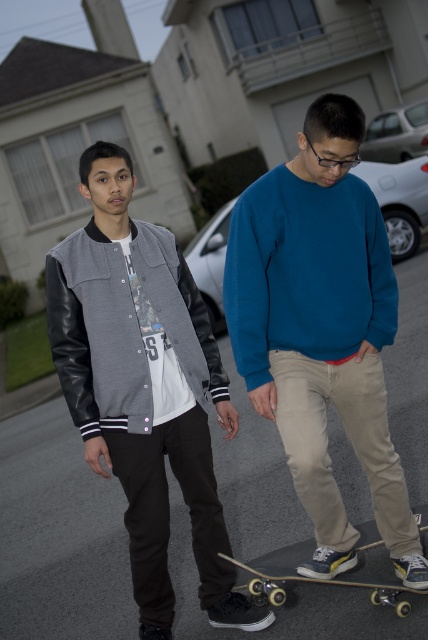
Is gray fabric jacket at center taller than wooden skateboard at lower center?

Yes.

What do you see at coordinates (143, 387) in the screenshot? I see `gray fabric jacket at center` at bounding box center [143, 387].

Is point (163, 560) in front of point (377, 593)?

No.

Locate an element on the screen. The width and height of the screenshot is (428, 640). gray fabric jacket at center is located at coordinates (143, 387).

Is point (309, 200) in front of point (202, 554)?

Yes, point (309, 200) is in front of point (202, 554).

In the scene shown: Does blue cotton sweatshirt at center have a greater height compared to gray fabric jacket at center?

In fact, blue cotton sweatshirt at center may be shorter than gray fabric jacket at center.

Who is more distant from viewer, (x=288, y=365) or (x=73, y=272)?

The point (x=73, y=272) is behind.

Locate an element on the screen. blue cotton sweatshirt at center is located at coordinates (321, 330).

Does blue cotton sweatshirt at center come in front of wooden skateboard at lower center?

Yes.

Does blue cotton sweatshirt at center appear on the left side of wooden skateboard at lower center?

Incorrect, blue cotton sweatshirt at center is not on the left side of wooden skateboard at lower center.

Is point (341, 324) closer to camera compared to point (273, 602)?

Yes, point (341, 324) is closer to viewer.

Image resolution: width=428 pixels, height=640 pixels. I want to click on blue cotton sweatshirt at center, so click(321, 330).